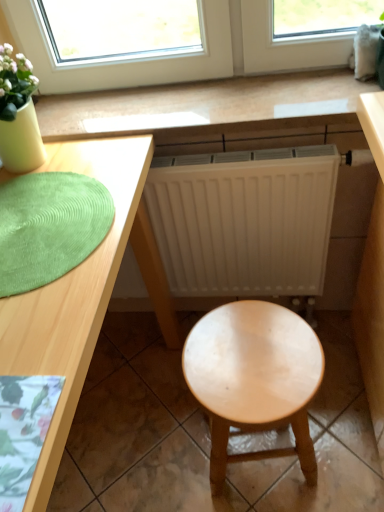
The height and width of the screenshot is (512, 384). I want to click on wooden table at center, so click(205, 106).

From the image's perspective, is wooden table at center under green textured mat at left?

No, from the image's perspective, wooden table at center is not below green textured mat at left.

From the picture: Looking at the image, does wooden table at center seem bigger or smaller compared to green textured mat at left?

Considering their sizes, wooden table at center takes up more space than green textured mat at left.

Who is shorter, wooden table at center or green textured mat at left?

With less height is green textured mat at left.

Is wooden table at center located outside green textured mat at left?

Indeed, wooden table at center is completely outside green textured mat at left.

Between point (303, 84) and point (15, 324), which one is positioned behind?

The point (303, 84) is farther from the camera.

From a real-world perspective, is wooden table at center located beneath light wood desk at center?

No, from a real-world perspective, wooden table at center is not below light wood desk at center.

Is wooden table at center at the right side of light wood desk at center?

Yes.

Based on the photo, what's the angular difference between wooden table at center and light wood desk at center's facing directions?

The angular difference between wooden table at center and light wood desk at center is 0.0932 degrees.

From the image's perspective, who appears lower, light brown wood stool at center or wooden table at center?

light brown wood stool at center is shown below in the image.

Would you say light brown wood stool at center contains wooden table at center?

Definitely not — wooden table at center is not inside light brown wood stool at center.

Considering the positions of objects light brown wood stool at center and wooden table at center in the image provided, who is more to the right, light brown wood stool at center or wooden table at center?

light brown wood stool at center is more to the right.

Considering the positions of point (222, 342) and point (198, 88), is point (222, 342) closer or farther from the camera than point (198, 88)?

Point (222, 342) is positioned closer to the camera compared to point (198, 88).

Considering the positions of points (52, 372) and (2, 288), is point (52, 372) closer to camera compared to point (2, 288)?

Yes.

In the image, there is a green textured mat at left. Where is `desk below it (from a real-world perspective)`? desk below it (from a real-world perspective) is located at coordinates (73, 294).

Considering the sizes of objects light wood desk at center and green textured mat at left in the image provided, who is bigger, light wood desk at center or green textured mat at left?

light wood desk at center is bigger.

Looking at this image, from a real-world perspective, is light wood desk at center physically located above or below wooden table at center?

light wood desk at center is below wooden table at center.

The width and height of the screenshot is (384, 512). In order to click on counter top on the right of light wood desk at center in this screenshot , I will do `click(205, 106)`.

From the picture: From the image's perspective, is light wood desk at center below wooden table at center?

Yes.

Which of these two, light brown wood stool at center or light wood desk at center, is wider?

light wood desk at center is wider.

Does light brown wood stool at center turn towards light wood desk at center?

Yes, light brown wood stool at center is oriented towards light wood desk at center.

From the picture: Which is behind, light brown wood stool at center or light wood desk at center?

Positioned behind is light brown wood stool at center.

Is there a large distance between light brown wood stool at center and light wood desk at center?

light brown wood stool at center is near light wood desk at center, not far away.

From a real-world perspective, which is physically below, light wood desk at center or light brown wood stool at center?

light brown wood stool at center, from a real-world perspective.

Considering the relative sizes of light wood desk at center and light brown wood stool at center in the image provided, is light wood desk at center shorter than light brown wood stool at center?

No.

Is light brown wood stool at center at the back of light wood desk at center?

That's not correct — light wood desk at center is not looking away from light brown wood stool at center.

Image resolution: width=384 pixels, height=512 pixels. Identify the location of counter top that appears below the green textured mat at left (from a real-world perspective). (205, 106).

You are a GUI agent. You are given a task and a screenshot of the screen. Output one action in this format:
    pyautogui.click(x=<x>, y=<y>)
    Task: Click on the desk lying in front of the wooden table at center
    The width and height of the screenshot is (384, 512).
    Given the screenshot: What is the action you would take?
    pyautogui.click(x=73, y=294)

Which object lies further to the anchor point light brown wood stool at center, green textured mat at left or light wood desk at center?

green textured mat at left lies further to light brown wood stool at center than the other object.

Estimate the real-world distances between objects in this image. Which object is closer to green textured mat at left, light brown wood stool at center or light wood desk at center?

The object closer to green textured mat at left is light wood desk at center.

Estimate the real-world distances between objects in this image. Which object is further from light wood desk at center, light brown wood stool at center or wooden table at center?

light brown wood stool at center.

Considering their positions, is light wood desk at center positioned further to green textured mat at left than wooden table at center?

Based on the image, wooden table at center appears to be further to green textured mat at left.

Considering their positions, is light wood desk at center positioned closer to wooden table at center than green textured mat at left?

light wood desk at center.

Which object lies nearer to the anchor point wooden table at center, light wood desk at center or light brown wood stool at center?

light wood desk at center.

When comparing their distances from light wood desk at center, does wooden table at center or green textured mat at left seem closer?

The object closer to light wood desk at center is green textured mat at left.

When comparing their distances from light wood desk at center, does green textured mat at left or light brown wood stool at center seem closer?

green textured mat at left lies closer to light wood desk at center than the other object.

The image size is (384, 512). Find the location of `desk between wooden table at center and light brown wood stool at center vertically`. desk between wooden table at center and light brown wood stool at center vertically is located at coordinates (73, 294).

The height and width of the screenshot is (512, 384). In order to click on mat located between light wood desk at center and light brown wood stool at center in the left-right direction in this screenshot , I will do `click(49, 227)`.

You are a GUI agent. You are given a task and a screenshot of the screen. Output one action in this format:
    pyautogui.click(x=<x>, y=<y>)
    Task: Click on the mat between wooden table at center and light wood desk at center in the vertical direction
    This screenshot has width=384, height=512.
    Given the screenshot: What is the action you would take?
    pyautogui.click(x=49, y=227)

Where is `mat that lies between wooden table at center and light brown wood stool at center from top to bottom`? The image size is (384, 512). mat that lies between wooden table at center and light brown wood stool at center from top to bottom is located at coordinates (49, 227).